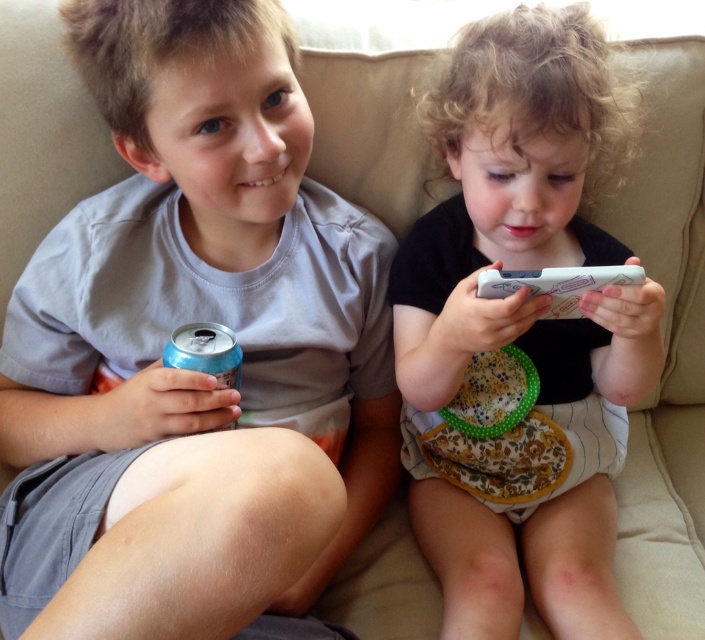
You are a parent trying to hand your child a toy that is 12 inches long. You see the matte blue can at left and the white plastic remote at center. Which object is closer to the toy if the toy is placed exactly between them?

The toy is placed exactly between the matte blue can at left and the white plastic remote at center. Since the distance between them is 14.57 inches, the toy would be 7.285 inches away from each object. However, since the toy is 12 inches long, it would extend beyond both objects. Therefore, neither is closer as the toy spans the distance between them.